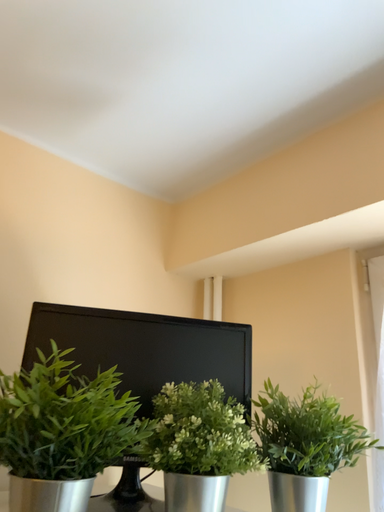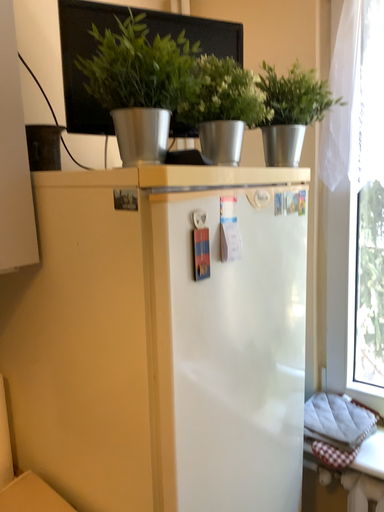
Question: Which way did the camera rotate in the video?

Choices:
 (A) rotated downward
 (B) rotated upward

Answer: (A)